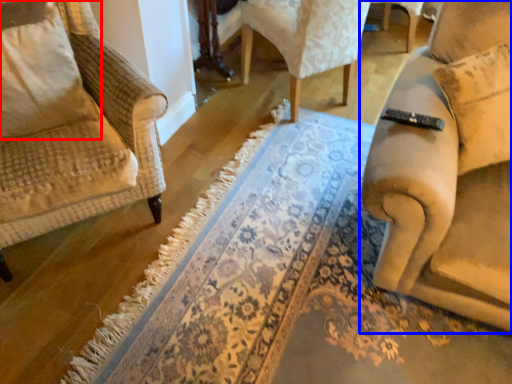
Question: Among these objects, which one is farthest to the camera, pillow (highlighted by a red box) or chair (highlighted by a blue box)?

Choices:
 (A) pillow
 (B) chair

Answer: (A)